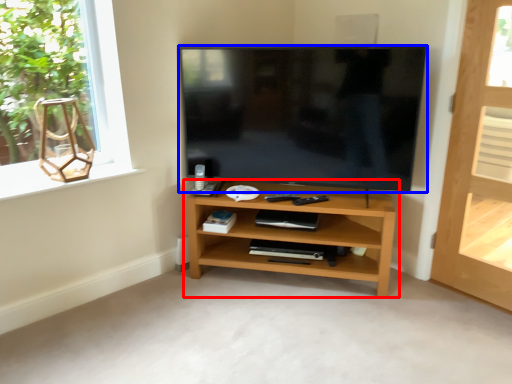
Question: Among these objects, which one is nearest to the camera, shelf (highlighted by a red box) or television (highlighted by a blue box)?

Choices:
 (A) shelf
 (B) television

Answer: (B)